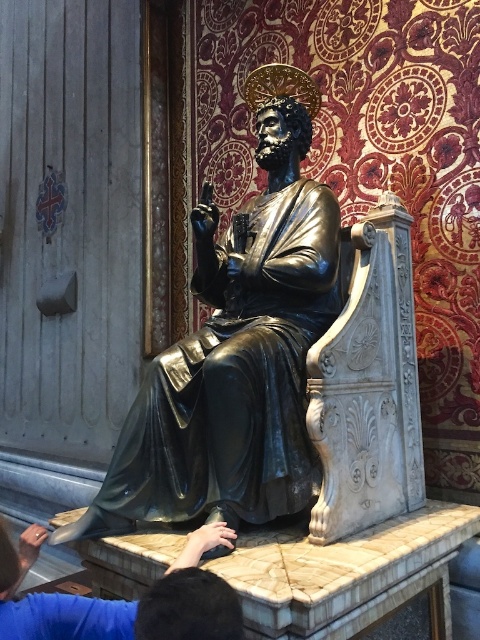
Question: Which point is closer to the camera?

Choices:
 (A) (29, 628)
 (B) (276, 371)

Answer: (A)

Question: Is shiny bronze statue at center bigger than blue fabric hand at lower center?

Choices:
 (A) yes
 (B) no

Answer: (A)

Question: Among these objects, which one is farthest from the camera?

Choices:
 (A) shiny bronze statue at center
 (B) blue fabric hand at lower center

Answer: (A)

Question: Is shiny bronze statue at center thinner than blue fabric hand at lower center?

Choices:
 (A) yes
 (B) no

Answer: (B)

Question: Can you confirm if shiny bronze statue at center is positioned to the right of blue fabric hand at lower center?

Choices:
 (A) no
 (B) yes

Answer: (B)